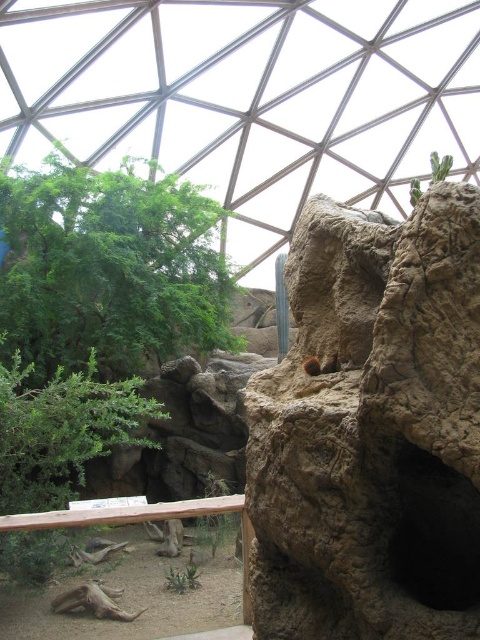
Question: Does brown rough rock at center appear on the left side of green leafy tree at lower left?

Choices:
 (A) yes
 (B) no

Answer: (B)

Question: Where is brown rough rock at center located in relation to green leafy tree at upper left in the image?

Choices:
 (A) left
 (B) right

Answer: (B)

Question: Which point is closer to the camera taking this photo?

Choices:
 (A) (105, 396)
 (B) (456, 300)
 (C) (128, 371)

Answer: (B)

Question: Which object is the farthest from the brown rough rock at center?

Choices:
 (A) green leafy tree at upper left
 (B) green leafy tree at lower left

Answer: (A)

Question: Does green leafy tree at upper left have a smaller size compared to green leafy tree at lower left?

Choices:
 (A) yes
 (B) no

Answer: (B)

Question: Which of the following is the closest to the observer?

Choices:
 (A) green leafy tree at upper left
 (B) green leafy tree at lower left
 (C) brown rough rock at center

Answer: (C)